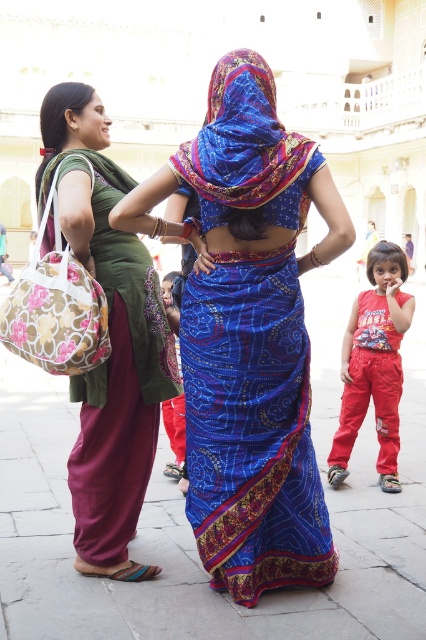
You are a photographer trying to capture a clear shot of both the matte green sari at left and the red cotton pants at lower right. Since you want both subjects to be in focus, which one should you adjust your camera focus on first?

The matte green sari at left is in front of the red cotton pants at lower right, so you should focus on the matte green sari at left first to ensure both are in focus.

You are a photographer standing at the entrance of the courtyard. You want to take a photo that includes both the blue satin saree at center and the matte green sari at left. Given that your camera has a maximum focus range of 6 feet, will you be able to capture both in focus?

The blue satin saree at center is 7.02 feet away from the matte green sari at left. Since the distance between them exceeds the camera maximum focus range of 6 feet, you won not be able to capture both in focus.